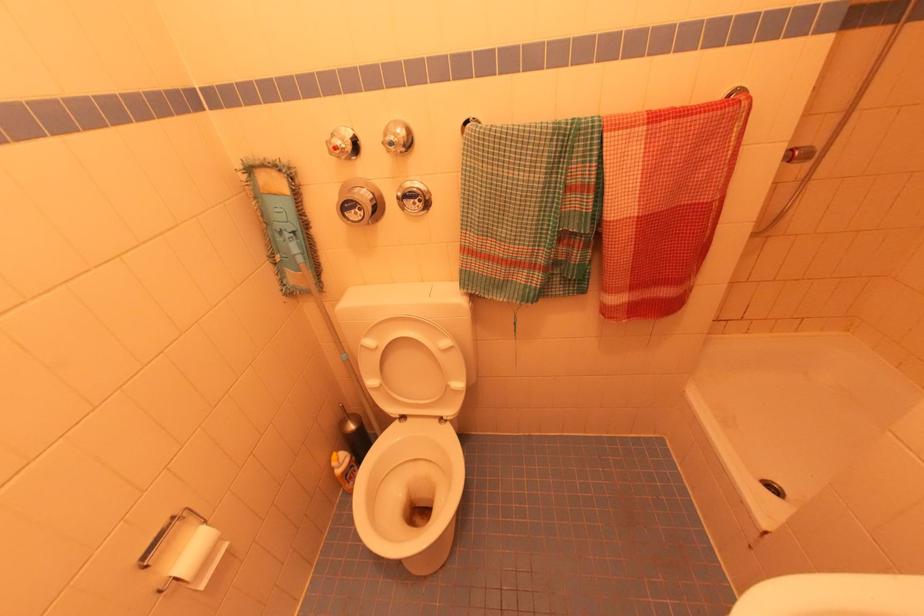
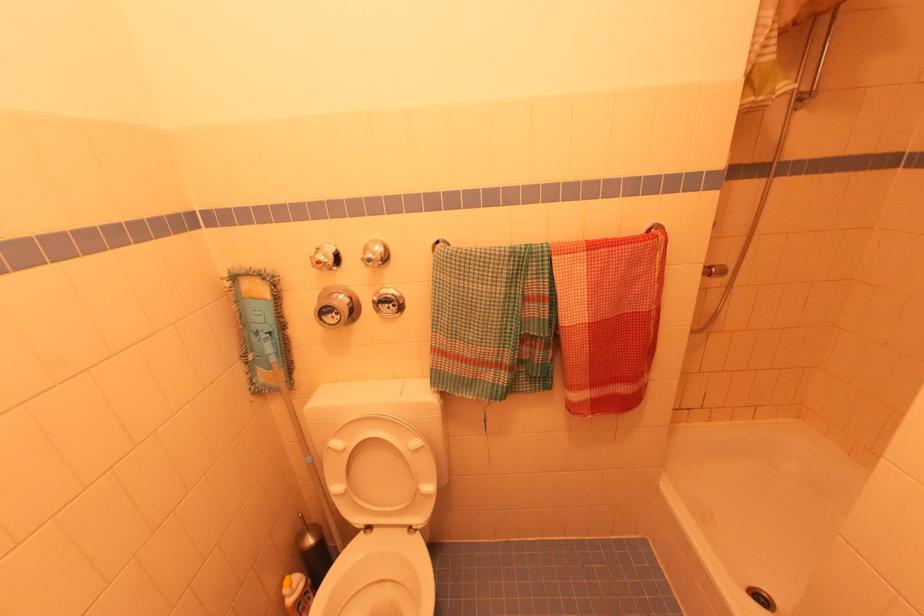
In the second image, find the point that corresponds to [367,338] in the first image.

(334, 439)